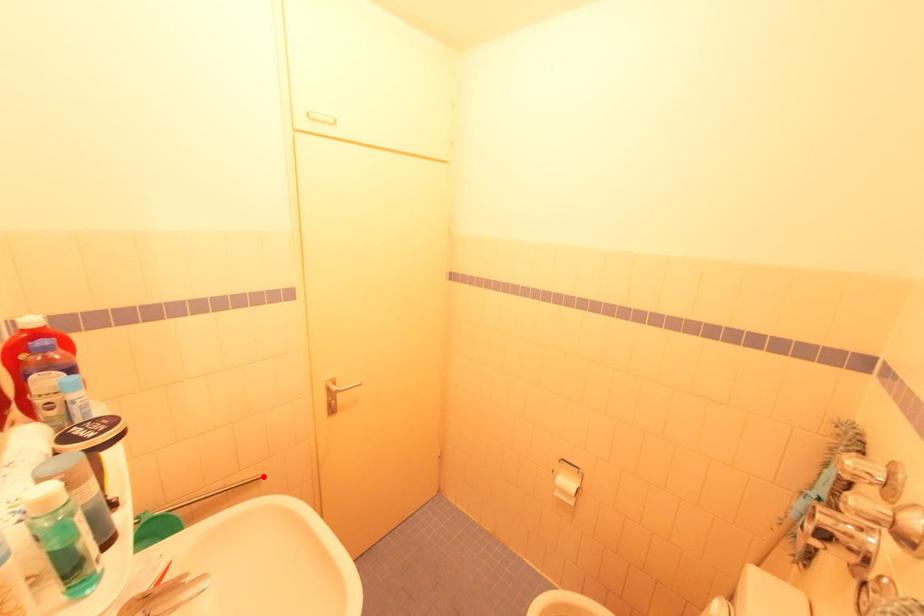
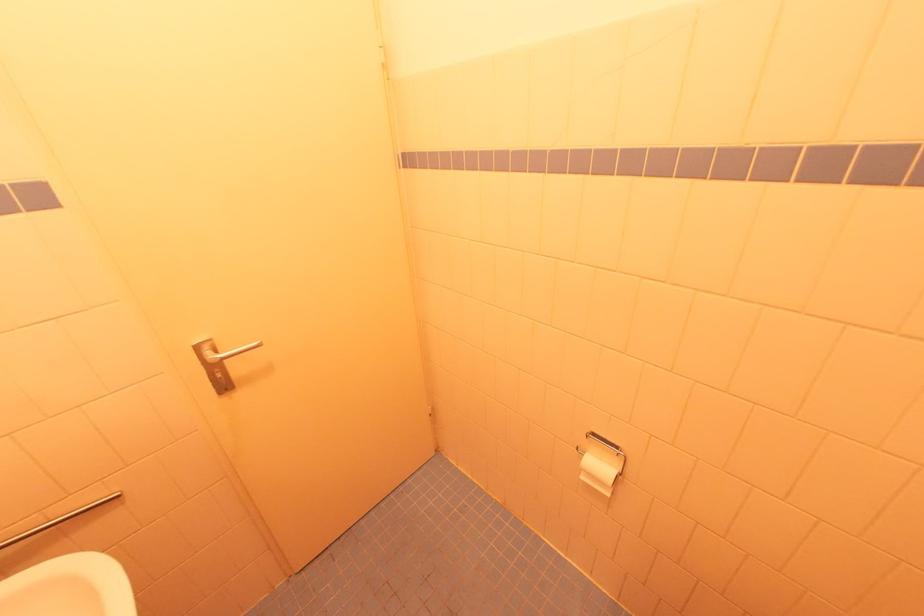
Locate, in the second image, the point that corresponds to the highlighted location in the first image.

(120, 495)